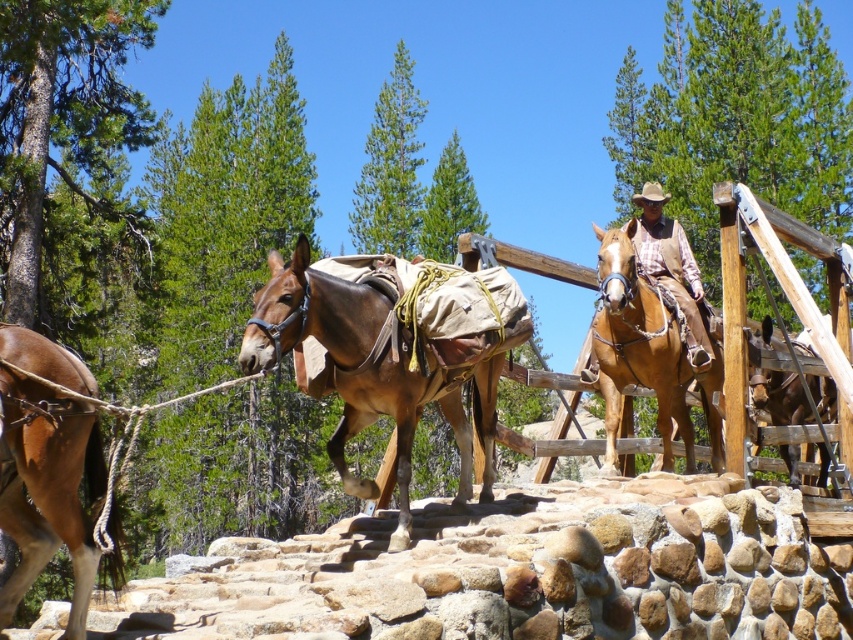
Is brown leather horse at left smaller than brown leather saddle at right?

Yes, brown leather horse at left is smaller than brown leather saddle at right.

Which of these two, brown leather horse at left or brown leather saddle at right, stands taller?

brown leather saddle at right

Image resolution: width=853 pixels, height=640 pixels. I want to click on brown leather horse at left, so click(x=47, y=486).

Is point (457, 433) farther from camera compared to point (668, 449)?

That is False.

Which of these two, brown leather pack mule at center or brown leather horse at center, stands shorter?

Standing shorter between the two is brown leather pack mule at center.

The width and height of the screenshot is (853, 640). What are the coordinates of `brown leather pack mule at center` in the screenshot? It's located at (379, 368).

Who is more distant from viewer, [320,292] or [782,422]?

The point [782,422] is more distant.

Who is positioned more to the left, brown leather pack mule at center or brown leather saddle at right?

Positioned to the left is brown leather pack mule at center.

Who is more distant from viewer, (387, 308) or (764, 374)?

Positioned behind is point (764, 374).

The image size is (853, 640). I want to click on brown leather pack mule at center, so click(379, 368).